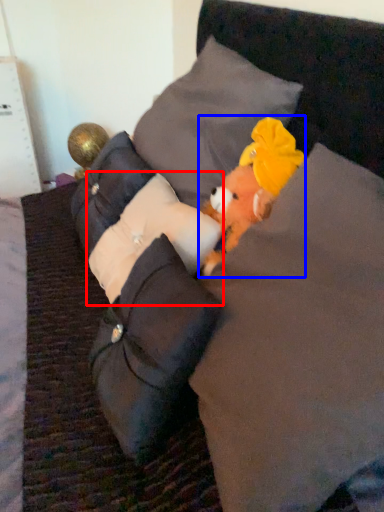
Question: Among these objects, which one is nearest to the camera, pillow (highlighted by a red box) or toy (highlighted by a blue box)?

Choices:
 (A) pillow
 (B) toy

Answer: (B)